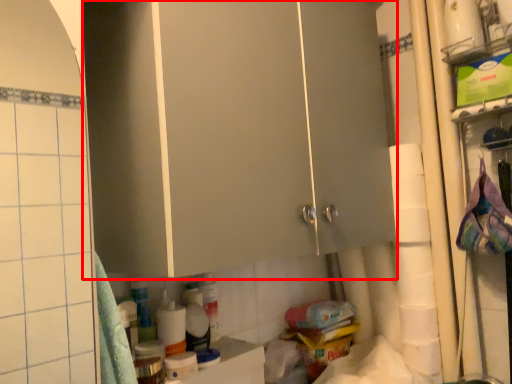
Question: From the image's perspective, where is cabinetry (annotated by the red box) located in relation to toilet paper in the image?

Choices:
 (A) below
 (B) above

Answer: (B)